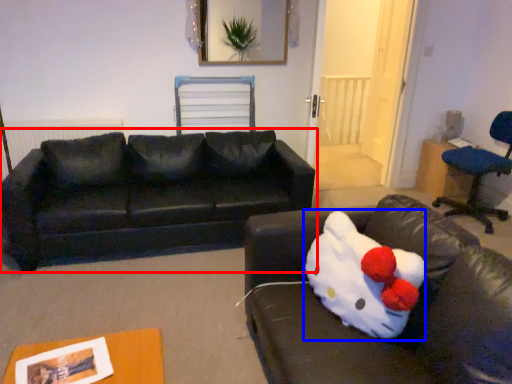
Question: Which object appears closest to the camera in this image, studio couch (highlighted by a red box) or animal (highlighted by a blue box)?

Choices:
 (A) studio couch
 (B) animal

Answer: (B)